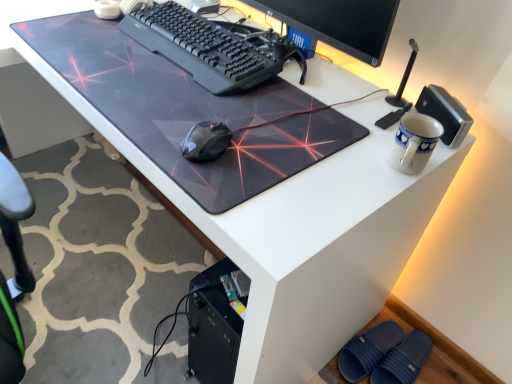
Question: From a real-world perspective, does blue textured slipper at lower right sit lower than transparent plastic mousepad at center?

Choices:
 (A) yes
 (B) no

Answer: (A)

Question: Is blue textured slipper at lower right oriented away from transparent plastic mousepad at center?

Choices:
 (A) yes
 (B) no

Answer: (B)

Question: Is blue textured slipper at lower right thinner than transparent plastic mousepad at center?

Choices:
 (A) no
 (B) yes

Answer: (B)

Question: Does blue textured slipper at lower right have a lesser height compared to transparent plastic mousepad at center?

Choices:
 (A) no
 (B) yes

Answer: (A)

Question: From the image's perspective, is blue textured slipper at lower right under transparent plastic mousepad at center?

Choices:
 (A) yes
 (B) no

Answer: (A)

Question: Would you say blue ceramic mug at upper right is to the left or to the right of transparent plastic mousepad at center in the picture?

Choices:
 (A) right
 (B) left

Answer: (A)

Question: From the image's perspective, is blue ceramic mug at upper right positioned above or below transparent plastic mousepad at center?

Choices:
 (A) above
 (B) below

Answer: (B)

Question: Is blue ceramic mug at upper right inside the boundaries of transparent plastic mousepad at center, or outside?

Choices:
 (A) outside
 (B) inside

Answer: (A)

Question: Is point (406, 147) positioned closer to the camera than point (133, 102)?

Choices:
 (A) farther
 (B) closer

Answer: (B)

Question: From the image's perspective, relative to black plastic keyboard at center, is blue rubber slippers at lower right above or below?

Choices:
 (A) below
 (B) above

Answer: (A)

Question: From a real-world perspective, relative to black plastic keyboard at center, is blue rubber slippers at lower right vertically above or below?

Choices:
 (A) below
 (B) above

Answer: (A)

Question: In terms of width, does blue rubber slippers at lower right look wider or thinner when compared to black plastic keyboard at center?

Choices:
 (A) thin
 (B) wide

Answer: (B)

Question: Is blue rubber slippers at lower right bigger or smaller than black plastic keyboard at center?

Choices:
 (A) big
 (B) small

Answer: (B)

Question: In terms of height, does transparent plastic mousepad at center look taller or shorter compared to blue textured slipper at lower right?

Choices:
 (A) tall
 (B) short

Answer: (B)

Question: Considering the positions of point (140, 144) and point (418, 362), is point (140, 144) closer or farther from the camera than point (418, 362)?

Choices:
 (A) closer
 (B) farther

Answer: (A)